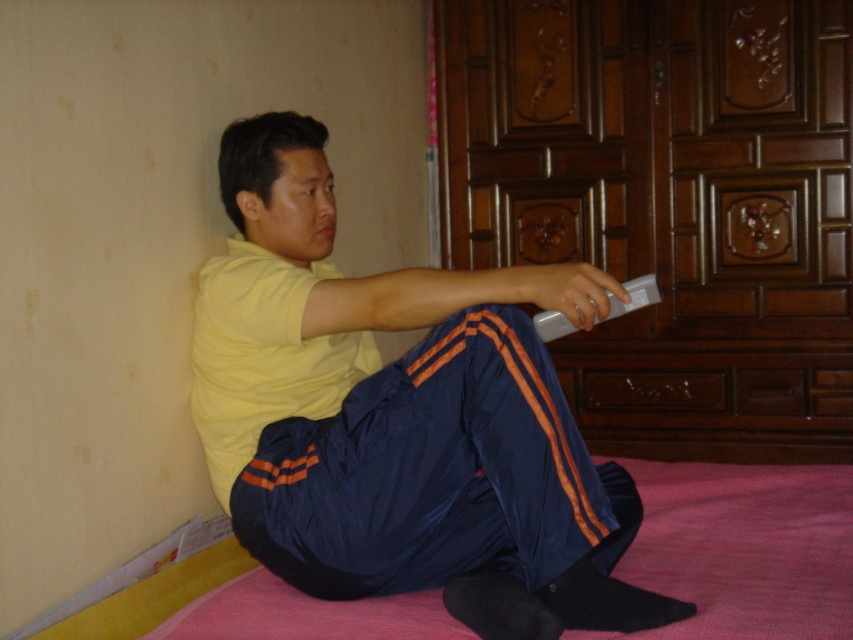
You are a fashion designer analyzing the image. You need to compare the sizes of the yellow matte shirt at center and the silver metallic remote at center. Which object is wider?

The yellow matte shirt at center is wider than the silver metallic remote at center according to the description provided.

You are a photographer trying to capture a closeup of the silver metallic remote at center. To avoid including the yellow matte shirt at center in the photo, should you pan your camera to the right or left?

The yellow matte shirt at center is to the left of the silver metallic remote at center. To avoid including the yellow matte shirt at center, pan the camera to the right.

You are a delivery robot that is 1 meter tall. You need to place a package on a table that is at the same height as the yellow matte shirt at center. Can you reach the table?

The yellow matte shirt at center and viewer are 1.26 meters apart from each other. Since the robot is 1 meter tall, it may not be able to reach the table if the table is placed at the same height as the yellow matte shirt at center, which is 1.26 meters above the ground. Therefore, the robot cannot reach the table.